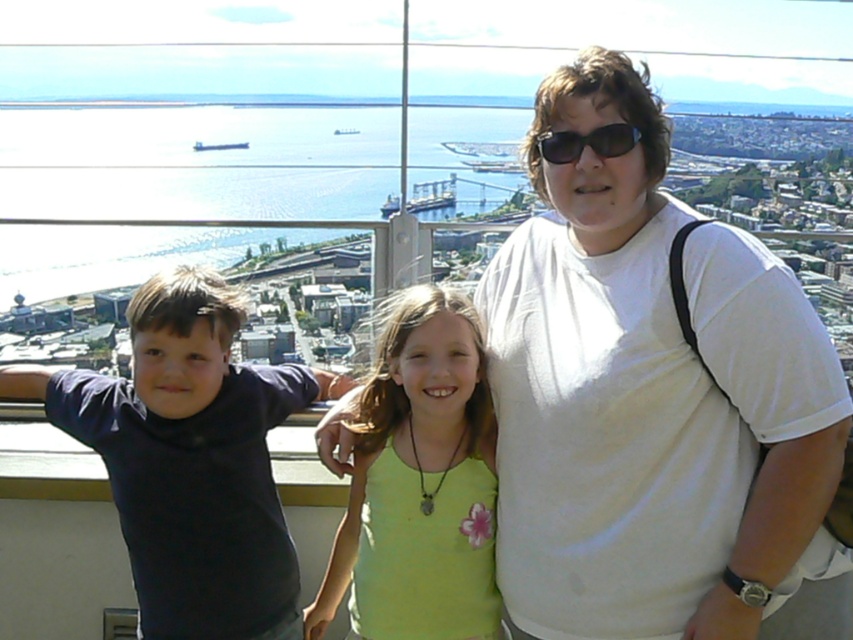
Question: From the image, what is the correct spatial relationship of green fabric shirt at center in relation to black plastic sunglasses at upper center?

Choices:
 (A) above
 (B) below

Answer: (B)

Question: Which of the following is the closest to the observer?

Choices:
 (A) white cotton shirt at center
 (B) dark blue shirt at left
 (C) black plastic sunglasses at upper center
 (D) green fabric shirt at center

Answer: (A)

Question: Does white cotton shirt at center appear on the left side of green fabric shirt at center?

Choices:
 (A) yes
 (B) no

Answer: (B)

Question: Which object is closer to the camera taking this photo?

Choices:
 (A) white cotton shirt at center
 (B) black plastic sunglasses at upper center

Answer: (A)

Question: From the image, what is the correct spatial relationship of white cotton shirt at center in relation to green fabric shirt at center?

Choices:
 (A) above
 (B) below

Answer: (A)

Question: Which object is closer to the camera taking this photo?

Choices:
 (A) white cotton shirt at center
 (B) black plastic sunglasses at upper center
 (C) dark blue shirt at left

Answer: (A)